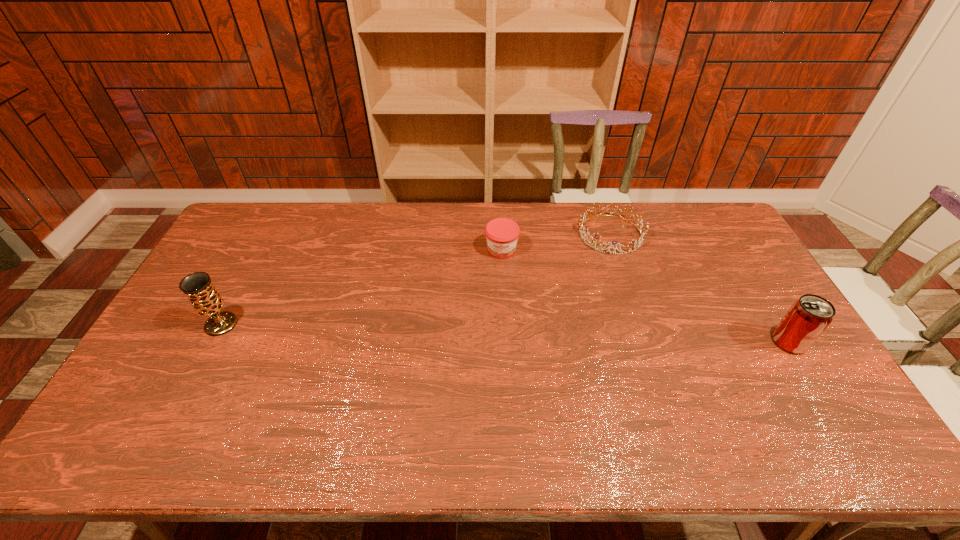
Locate an element on the screen. This screenshot has width=960, height=540. free space located on the label side of the jam is located at coordinates (501, 287).

In order to click on vacant space located 0.400m on the label side of the jam in this screenshot , I will do `click(500, 360)`.

Find the location of a particular element. The image size is (960, 540). blank space located on the front-facing side of the tiara is located at coordinates (538, 306).

Locate an element on the screen. Image resolution: width=960 pixels, height=540 pixels. vacant point located 0.220m on the front-facing side of the tiara is located at coordinates (559, 285).

You are a GUI agent. You are given a task and a screenshot of the screen. Output one action in this format:
    pyautogui.click(x=<x>, y=<y>)
    Task: Click on the blank area located on the front-facing side of the tiara
    This screenshot has height=540, width=960.
    Given the screenshot: What is the action you would take?
    pyautogui.click(x=563, y=281)

The height and width of the screenshot is (540, 960). I want to click on jam that is at the far edge, so click(x=502, y=234).

You are a GUI agent. You are given a task and a screenshot of the screen. Output one action in this format:
    pyautogui.click(x=<x>, y=<y>)
    Task: Click on the tiara present at the far edge
    
    Given the screenshot: What is the action you would take?
    pyautogui.click(x=596, y=236)

At what (x,y) coordinates should I click in order to perform the action: click on object that is at the left edge. Please return your answer as a coordinate pair (x, y). Image resolution: width=960 pixels, height=540 pixels. Looking at the image, I should click on (205, 299).

Identify the location of object that is at the right edge. (808, 317).

Find the location of `vacant space at the far edge of the desktop`. vacant space at the far edge of the desktop is located at coordinates (652, 210).